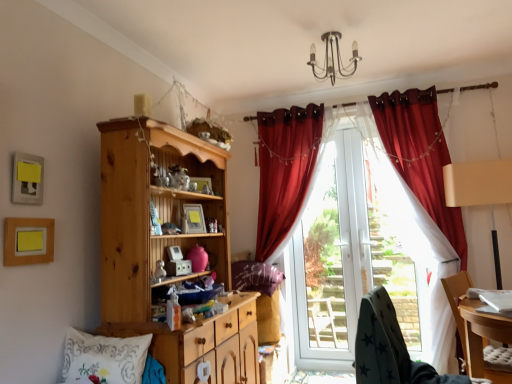
Question: Is white embroidered pillow at lower left, the 2th pillow viewed from the back, shorter than matte yellow picture frame at upper left, marked as the 2th picture frame in a front-to-back arrangement?

Choices:
 (A) no
 (B) yes

Answer: (A)

Question: Is white embroidered pillow at lower left, the 1th pillow when ordered from front to back, smaller than matte yellow picture frame at upper left, acting as the 1th picture frame starting from the left?

Choices:
 (A) no
 (B) yes

Answer: (A)

Question: Is the depth of white embroidered pillow at lower left, the 1th pillow when ordered from front to back, greater than that of matte yellow picture frame at upper left, marked as the 2th picture frame in a front-to-back arrangement?

Choices:
 (A) yes
 (B) no

Answer: (B)

Question: Is white embroidered pillow at lower left, the 2th pillow viewed from the back, wider than matte yellow picture frame at upper left, acting as the fourth picture frame starting from the right?

Choices:
 (A) yes
 (B) no

Answer: (A)

Question: From the image's perspective, is white embroidered pillow at lower left, the second pillow positioned from the right, above matte yellow picture frame at upper left, marked as the 2th picture frame in a front-to-back arrangement?

Choices:
 (A) no
 (B) yes

Answer: (A)

Question: In terms of width, does white embroidered pillow at lower left, the second pillow positioned from the right, look wider or thinner when compared to matte yellow picture frame at upper left, acting as the fourth picture frame starting from the right?

Choices:
 (A) wide
 (B) thin

Answer: (A)

Question: Is white embroidered pillow at lower left, the 1th pillow when ordered from front to back, inside the boundaries of matte yellow picture frame at upper left, acting as the 1th picture frame starting from the left, or outside?

Choices:
 (A) outside
 (B) inside

Answer: (A)

Question: In terms of height, does white embroidered pillow at lower left, the 1th pillow when ordered from front to back, look taller or shorter compared to matte yellow picture frame at upper left, acting as the 1th picture frame starting from the left?

Choices:
 (A) short
 (B) tall

Answer: (B)

Question: From a real-world perspective, is white embroidered pillow at lower left, the 2th pillow viewed from the back, physically located above or below matte yellow picture frame at upper left, acting as the fourth picture frame starting from the right?

Choices:
 (A) above
 (B) below

Answer: (B)

Question: From the image's perspective, relative to white embroidered pillow at lower left, the second pillow positioned from the right, is dark grey fabric chair at lower right, positioned as the second chair in right-to-left order, above or below?

Choices:
 (A) above
 (B) below

Answer: (A)

Question: Considering the positions of dark grey fabric chair at lower right, positioned as the second chair in right-to-left order, and white embroidered pillow at lower left, the 1th pillow from the left, in the image, is dark grey fabric chair at lower right, positioned as the second chair in right-to-left order, bigger or smaller than white embroidered pillow at lower left, the 1th pillow from the left,?

Choices:
 (A) big
 (B) small

Answer: (A)

Question: In terms of height, does dark grey fabric chair at lower right, positioned as the second chair in right-to-left order, look taller or shorter compared to white embroidered pillow at lower left, the 1th pillow from the left?

Choices:
 (A) short
 (B) tall

Answer: (B)

Question: Considering the relative positions of dark grey fabric chair at lower right, arranged as the 1th chair when viewed from the left, and white embroidered pillow at lower left, the 2th pillow viewed from the back, in the image provided, is dark grey fabric chair at lower right, arranged as the 1th chair when viewed from the left, to the left or to the right of white embroidered pillow at lower left, the 2th pillow viewed from the back,?

Choices:
 (A) left
 (B) right

Answer: (B)

Question: From their relative heights in the image, would you say white embroidered pillow at lower left, the second pillow positioned from the right, is taller or shorter than purple fabric pillow at center, which is counted as the first pillow, starting from the right?

Choices:
 (A) tall
 (B) short

Answer: (B)

Question: From a real-world perspective, relative to purple fabric pillow at center, the 2th pillow from the left, is white embroidered pillow at lower left, the second pillow positioned from the right, vertically above or below?

Choices:
 (A) above
 (B) below

Answer: (B)